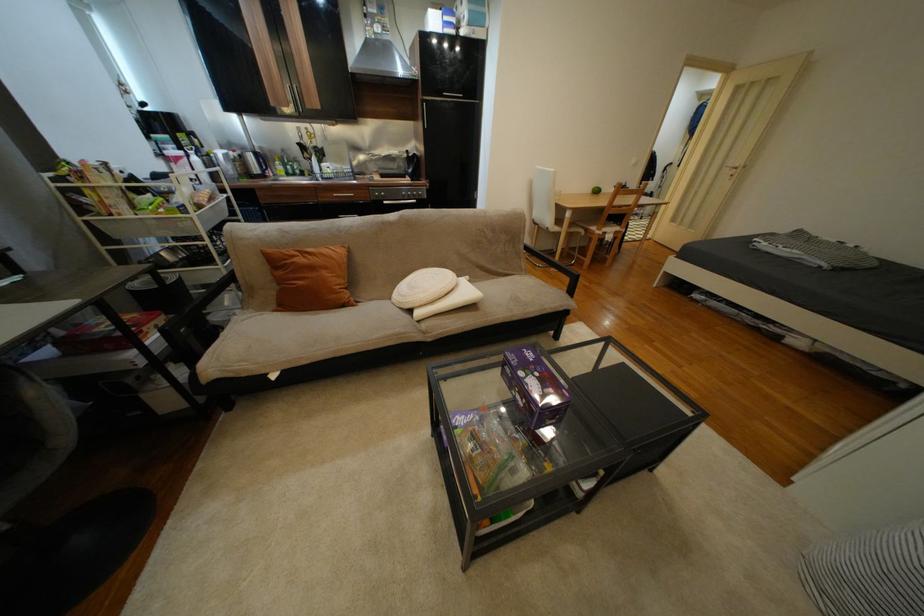
Where is `orange square cushion`? orange square cushion is located at coordinates (310, 278).